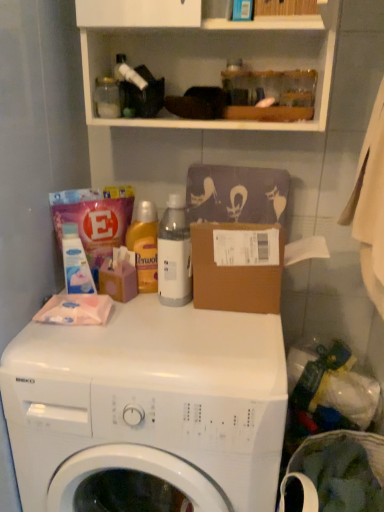
The height and width of the screenshot is (512, 384). Identify the location of white matte cabinet at upper center. (203, 51).

What is the approximate width of white plastic bottle at center?

It is 10.76 centimeters.

This screenshot has width=384, height=512. Describe the element at coordinates (148, 408) in the screenshot. I see `white glossy washing machine at center` at that location.

Locate an element on the screen. The width and height of the screenshot is (384, 512). white matte detergent at left is located at coordinates (75, 262).

Does white plastic bottle at center come in front of white matte cabinet at upper center?

No.

How different are the orientations of white plastic bottle at center and white matte cabinet at upper center in degrees?

They differ by 3.12 degrees in their facing directions.

Find the location of a particular element. This screenshot has width=384, height=512. bottle behind the white matte cabinet at upper center is located at coordinates (174, 254).

From the image's perspective, is white plastic bottle at center located beneath white matte cabinet at upper center?

Indeed, from the image's perspective, white plastic bottle at center is shown beneath white matte cabinet at upper center.

Looking at this image, is wooden box at upper center far from white plastic bottle at center?

wooden box at upper center is actually quite close to white plastic bottle at center.

From the image's perspective, which object appears higher, wooden box at upper center or white plastic bottle at center?

From the image's view, wooden box at upper center is above.

Is point (275, 11) positioned after point (176, 237)?

That is False.

Who is taller, wooden box at upper center or white plastic bottle at center?

white plastic bottle at center.

Is wooden box at upper center a part of translucent plastic bottle at center?

No.

Is translucent plastic bottle at center to the left of wooden box at upper center from the viewer's perspective?

Indeed, translucent plastic bottle at center is positioned on the left side of wooden box at upper center.

From a real-world perspective, is translucent plastic bottle at center beneath wooden box at upper center?

Correct, in the physical world, translucent plastic bottle at center is lower than wooden box at upper center.

Based on the photo, would you say wooden box at upper center is part of white matte detergent at left's contents?

No, white matte detergent at left does not contain wooden box at upper center.

From their relative heights in the image, would you say white matte detergent at left is taller or shorter than wooden box at upper center?

white matte detergent at left is taller than wooden box at upper center.

Is white matte detergent at left not close to wooden box at upper center?

No, there isn't a large distance between white matte detergent at left and wooden box at upper center.

From a real-world perspective, is white matte detergent at left positioned under wooden box at upper center based on gravity?

Indeed, from a real-world perspective, white matte detergent at left is positioned beneath wooden box at upper center.

Considering the points (79, 247) and (144, 255), which point is in front, point (79, 247) or point (144, 255)?

The point (79, 247) is more forward.

Which object is closer to the camera, white matte detergent at left or translucent plastic bottle at center?

white matte detergent at left.

Is white matte detergent at left situated inside translucent plastic bottle at center or outside?

white matte detergent at left is spatially situated outside translucent plastic bottle at center.

From the picture: From the image's perspective, which is above, white matte detergent at left or translucent plastic bottle at center?

translucent plastic bottle at center is shown above in the image.

From a real-world perspective, who is located lower, translucent plastic bottle at center or clear plastic laundry basket at lower right?

clear plastic laundry basket at lower right is physically lower.

From the image's perspective, is translucent plastic bottle at center beneath clear plastic laundry basket at lower right?

Actually, translucent plastic bottle at center appears above clear plastic laundry basket at lower right in the image.

Does translucent plastic bottle at center have a larger size compared to clear plastic laundry basket at lower right?

Actually, translucent plastic bottle at center might be smaller than clear plastic laundry basket at lower right.

Does translucent plastic bottle at center come in front of clear plastic laundry basket at lower right?

No, it is not.

Identify the location of box in front of the white matte detergent at left. (285, 7).

Is wooden box at upper center positioned behind white matte detergent at left?

No, wooden box at upper center is closer to the viewer.

Choose the correct answer: Is wooden box at upper center inside white matte detergent at left or outside it?

wooden box at upper center is not inside white matte detergent at left, it's outside.

Is wooden box at upper center facing towards white matte detergent at left?

No, wooden box at upper center is not facing towards white matte detergent at left.

Find the location of a particular element. cabinet on the right of the white plastic bottle at center is located at coordinates (203, 51).

Image resolution: width=384 pixels, height=512 pixels. What are the coordinates of `bottle behind the wooden box at upper center` in the screenshot? It's located at click(174, 254).

Which object lies nearer to the anchor point white matte detergent at left, wooden box at upper center or white glossy washing machine at center?

white glossy washing machine at center is positioned closer to the anchor white matte detergent at left.

Considering their positions, is white matte cabinet at upper center positioned closer to white plastic bottle at center than white glossy washing machine at center?

white glossy washing machine at center is positioned closer to the anchor white plastic bottle at center.

Estimate the real-world distances between objects in this image. Which object is further from white glossy washing machine at center, white matte cabinet at upper center or white plastic bottle at center?

Based on the image, white matte cabinet at upper center appears to be further to white glossy washing machine at center.

Based on their spatial positions, is white matte cabinet at upper center or white glossy washing machine at center further from wooden box at upper center?

white glossy washing machine at center.

Considering their positions, is white matte cabinet at upper center positioned further to white plastic bottle at center than white matte detergent at left?

Among the two, white matte cabinet at upper center is located further to white plastic bottle at center.

Estimate the real-world distances between objects in this image. Which object is closer to white plastic bottle at center, white matte detergent at left or white matte cabinet at upper center?

Among the two, white matte detergent at left is located nearer to white plastic bottle at center.

Which object lies nearer to the anchor point translucent plastic bottle at center, white matte detergent at left or white plastic bottle at center?

Based on the image, white plastic bottle at center appears to be nearer to translucent plastic bottle at center.

From the image, which object appears to be nearer to white matte cabinet at upper center, white plastic bottle at center or white matte detergent at left?

white plastic bottle at center is positioned closer to the anchor white matte cabinet at upper center.

Where is `bottle that lies between translucent plastic bottle at center and white glossy washing machine at center from top to bottom`? This screenshot has width=384, height=512. bottle that lies between translucent plastic bottle at center and white glossy washing machine at center from top to bottom is located at coordinates (174, 254).

The width and height of the screenshot is (384, 512). I want to click on washing machine between wooden box at upper center and clear plastic laundry basket at lower right in the up-down direction, so coord(148,408).

Locate an element on the screen. bottle between white matte cabinet at upper center and white matte detergent at left in the up-down direction is located at coordinates [x=174, y=254].

Identify the location of cabinet between wooden box at upper center and white matte detergent at left from top to bottom. The width and height of the screenshot is (384, 512). (203, 51).